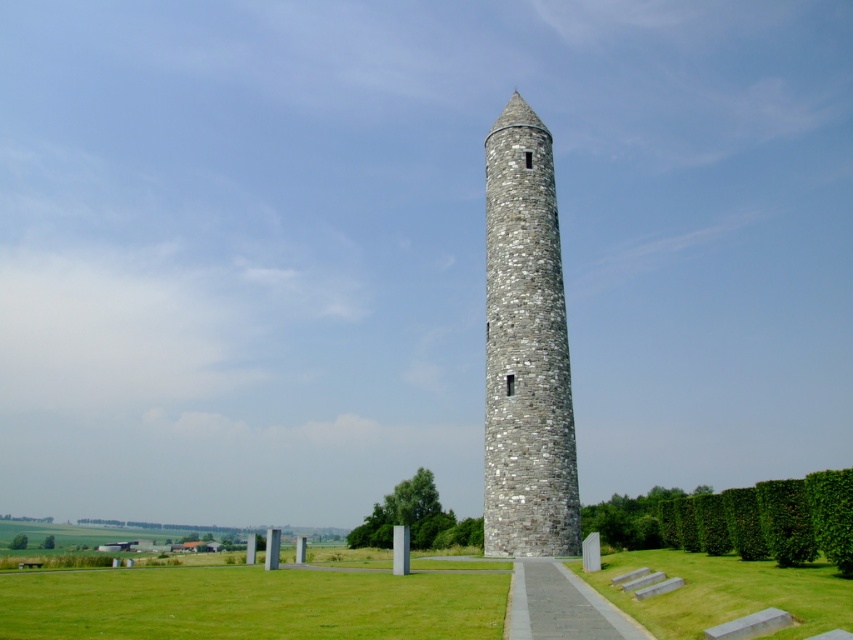
Question: Which of the following is the closest to the observer?

Choices:
 (A) green grass at lower left
 (B) gray concrete path at center
 (C) green grass at lower center
 (D) gray stone tower at center

Answer: (C)

Question: Is green grass at lower left closer to the viewer compared to gray concrete path at center?

Choices:
 (A) no
 (B) yes

Answer: (A)

Question: Is gray stone tower at center in front of green grass at lower left?

Choices:
 (A) yes
 (B) no

Answer: (B)

Question: From the image, what is the correct spatial relationship of gray stone tower at center in relation to green grass at lower center?

Choices:
 (A) below
 (B) above

Answer: (B)

Question: Considering the real-world distances, which object is farthest from the gray stone tower at center?

Choices:
 (A) gray concrete path at center
 (B) green grass at lower left

Answer: (B)

Question: Which object is positioned farthest from the gray concrete path at center?

Choices:
 (A) green grass at lower left
 (B) green grass at lower center

Answer: (A)